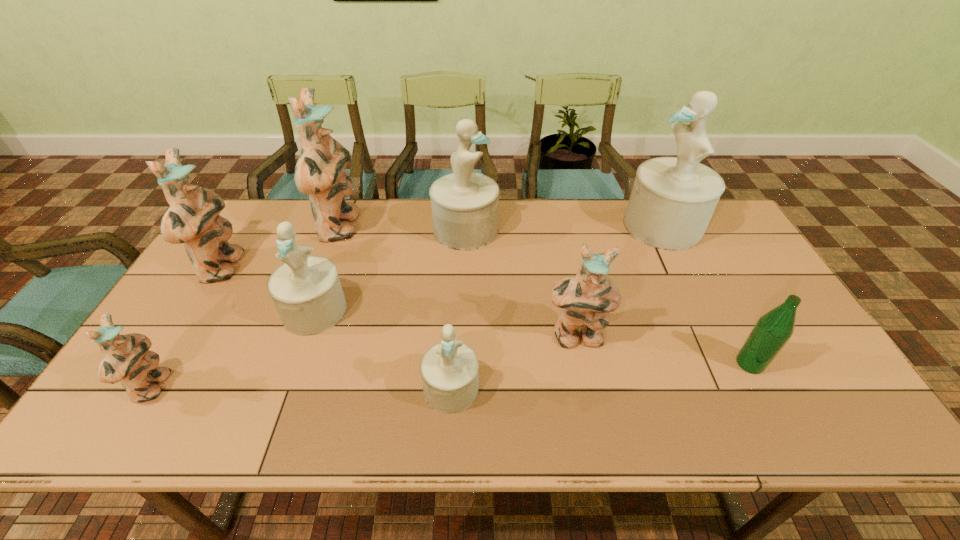
At what (x,y) coordinates should I click in order to perform the action: click on the seventh closest figurine relative to the second biggest white figurine. Please return your answer as a coordinate pair (x, y). The image size is (960, 540). Looking at the image, I should click on (127, 359).

Identify which figurine is located as the third nearest to the third pink figurine from left to right. Please provide its 2D coordinates. Your answer should be formatted as a tuple, i.e. [(x, y)], where the tuple contains the x and y coordinates of a point satisfying the conditions above.

[(465, 205)]

At what (x,y) coordinates should I click in order to perform the action: click on white figurine that stands as the third closest to the biggest white figurine. Please return your answer as a coordinate pair (x, y). Looking at the image, I should click on 306,290.

Locate which white figurine ranks third in proximity to the bottle. Please provide its 2D coordinates. Your answer should be formatted as a tuple, i.e. [(x, y)], where the tuple contains the x and y coordinates of a point satisfying the conditions above.

[(465, 205)]

Select which pink figurine is the fourth closest to the green bottle. Please provide its 2D coordinates. Your answer should be formatted as a tuple, i.e. [(x, y)], where the tuple contains the x and y coordinates of a point satisfying the conditions above.

[(192, 218)]

Identify which pink figurine is located as the second nearest to the rightmost pink figurine. Please provide its 2D coordinates. Your answer should be formatted as a tuple, i.e. [(x, y)], where the tuple contains the x and y coordinates of a point satisfying the conditions above.

[(192, 218)]

Locate an element on the screen. The height and width of the screenshot is (540, 960). vacant region that satisfies the following two spatial constraints: 1. on the front-facing side of the second biggest pink figurine; 2. on the left side of the bottle is located at coordinates (164, 363).

This screenshot has height=540, width=960. In order to click on vacant area in the image that satisfies the following two spatial constraints: 1. at the beak of the biggest white figurine; 2. on the front-facing side of the seventh object from left to right in this screenshot , I will do `click(718, 338)`.

You are a GUI agent. You are given a task and a screenshot of the screen. Output one action in this format:
    pyautogui.click(x=<x>, y=<y>)
    Task: Click on the free point that satisfies the following two spatial constraints: 1. on the front-facing side of the second biggest pink figurine; 2. on the right side of the green bottle
    
    Given the screenshot: What is the action you would take?
    pyautogui.click(x=164, y=363)

This screenshot has height=540, width=960. I want to click on vacant space that satisfies the following two spatial constraints: 1. on the back side of the bottle; 2. at the beak of the second biggest white figurine, so click(680, 230).